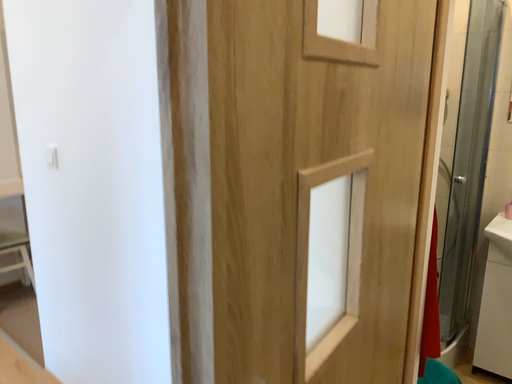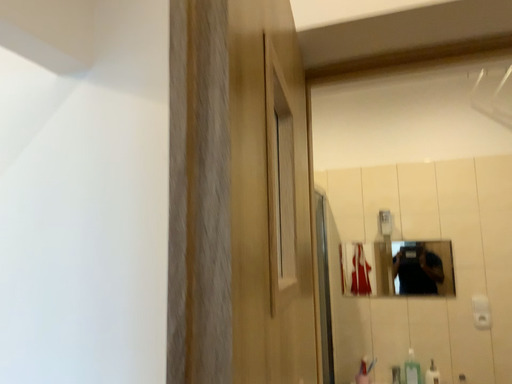
Question: Which way did the camera rotate in the video?

Choices:
 (A) rotated left
 (B) rotated right

Answer: (B)